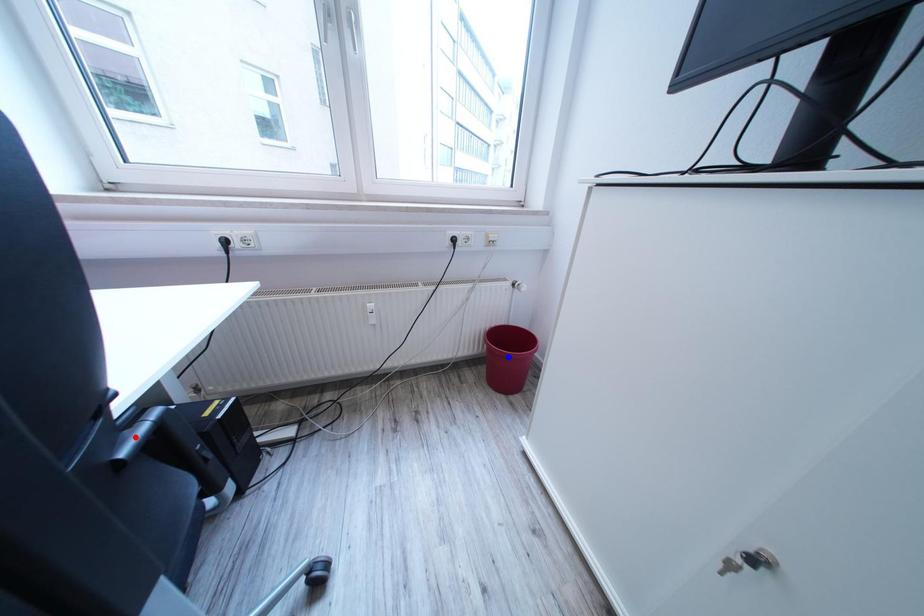
Question: Which of the two points in the image is closer to the camera?

Choices:
 (A) Blue point is closer.
 (B) Red point is closer.

Answer: (B)